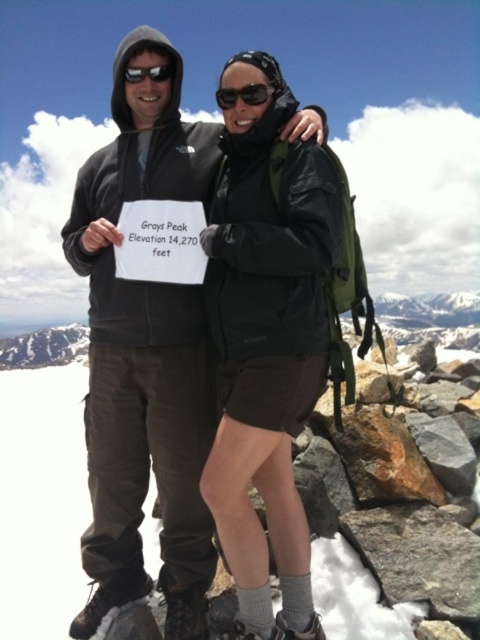
Can you confirm if white powder snow at lower center is shorter than black plastic goggles at center?

No.

Does point (20, 387) lie in front of point (217, 97)?

No, it is behind (217, 97).

Locate an element on the screen. The width and height of the screenshot is (480, 640). white powder snow at lower center is located at coordinates (3, 401).

Is matte black jacket at center behind white powder snow at lower center?

Result: No, it is not.

Between matte black jacket at center and white powder snow at lower center, which one appears on the right side from the viewer's perspective?

white powder snow at lower center is more to the right.

Is point (175, 70) farther from camera compared to point (448, 349)?

No.

Identify the location of matte black jacket at center. The height and width of the screenshot is (640, 480). (144, 355).

Is matte black jacket at center taller than black reflective sunglasses at upper center?

Yes.

From the picture: Does matte black jacket at center appear under black reflective sunglasses at upper center?

Yes.

Does point (167, 346) come closer to viewer compared to point (158, 76)?

Yes, point (167, 346) is closer to viewer.

Find the location of `matte black jacket at center`. matte black jacket at center is located at coordinates (144, 355).